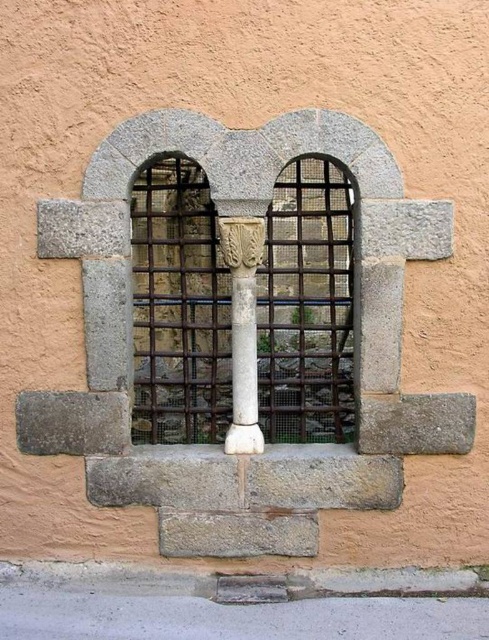
Who is lower down, stone arched window at center or white stone column at center?

white stone column at center

Does stone arched window at center have a greater width compared to white stone column at center?

Yes.

Describe the element at coordinates (178, 308) in the screenshot. The width and height of the screenshot is (489, 640). I see `stone arched window at center` at that location.

The width and height of the screenshot is (489, 640). Find the location of `stone arched window at center`. stone arched window at center is located at coordinates (178, 308).